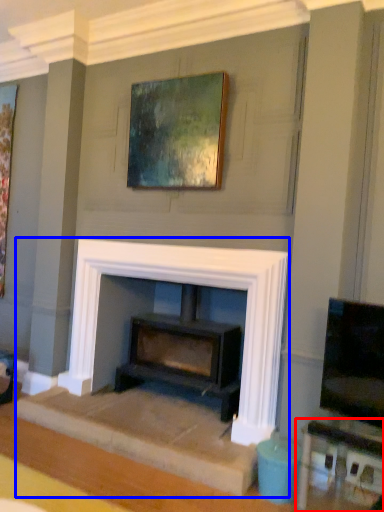
Question: Which of the following is the closest to the observer, table (highlighted by a red box) or fireplace (highlighted by a blue box)?

Choices:
 (A) table
 (B) fireplace

Answer: (A)